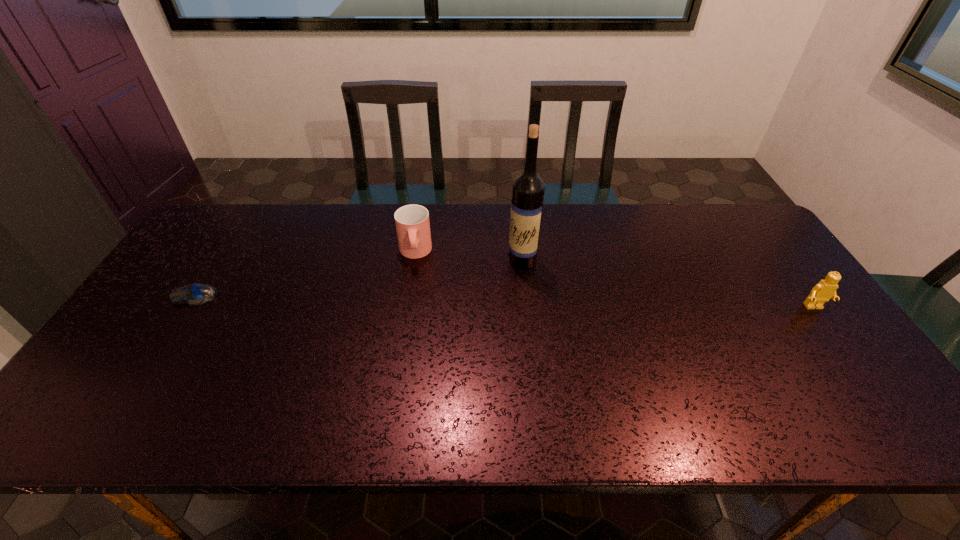
Find the location of a particular element. Image resolution: width=960 pixels, height=540 pixels. free spot on the desktop that is between the leftmost object and the rightmost object and is positioned on the side of the second object from left to right with the handle is located at coordinates (417, 300).

In order to click on free spot on the desktop that is between the leftmost object and the rightmost object and is positioned on the label of the wine bottle in this screenshot , I will do `click(447, 300)`.